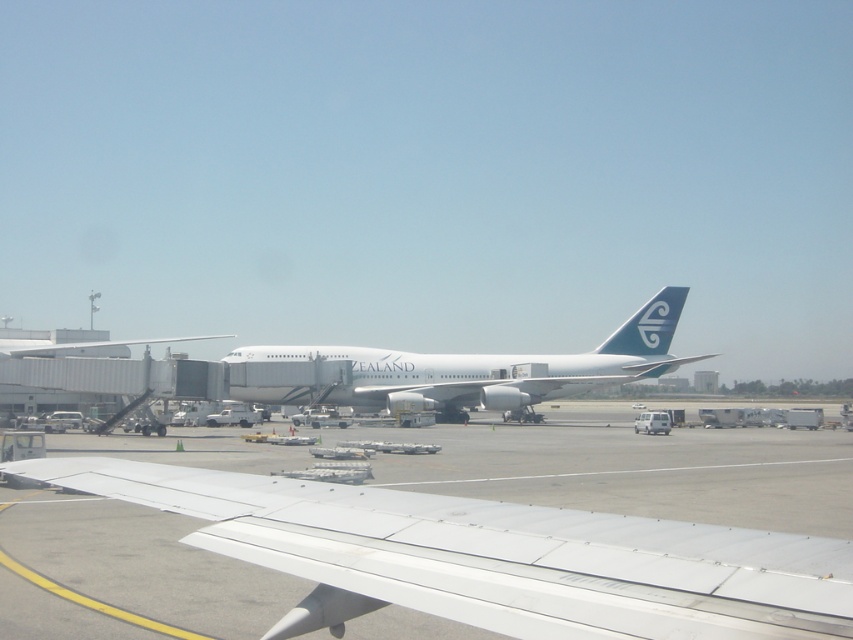
Who is lower down, white matte wing at center or blue glossy tail at center right?

white matte wing at center is below.

Is point (518, 532) positioned before point (608, 337)?

Yes.

Where is `white matte wing at center`? The image size is (853, 640). white matte wing at center is located at coordinates (490, 557).

Does white glossy airplane at center appear under blue glossy tail at center right?

Yes.

Does white glossy airplane at center lie behind blue glossy tail at center right?

No, white glossy airplane at center is in front of blue glossy tail at center right.

Does point (427, 388) lie in front of point (646, 336)?

Yes, point (427, 388) is in front of point (646, 336).

Where is `white glossy airplane at center`? Image resolution: width=853 pixels, height=640 pixels. white glossy airplane at center is located at coordinates (492, 368).

Looking at this image, is white matte wing at center closer to the viewer compared to white glossy airplane at center?

That is True.

What are the coordinates of `white matte wing at center` in the screenshot? It's located at (490, 557).